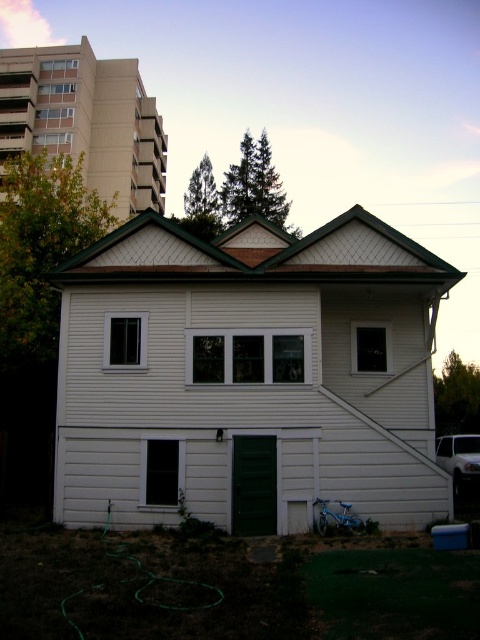
Question: Which point is farther from the camera taking this photo?

Choices:
 (A) (76, 106)
 (B) (236, 548)
 (C) (377, 472)

Answer: (A)

Question: Can you confirm if white woodshed at center is positioned below green grass at lower left?

Choices:
 (A) no
 (B) yes

Answer: (A)

Question: Does green grass at lower left appear over white siding shed at upper left?

Choices:
 (A) yes
 (B) no

Answer: (B)

Question: Can you confirm if green grass at lower left is smaller than white siding shed at upper left?

Choices:
 (A) yes
 (B) no

Answer: (A)

Question: Which object is farther from the camera taking this photo?

Choices:
 (A) green grass at lower left
 (B) white woodshed at center

Answer: (B)

Question: Which of the following is the closest to the observer?

Choices:
 (A) (170, 412)
 (B) (59, 102)
 (C) (106, 554)

Answer: (C)